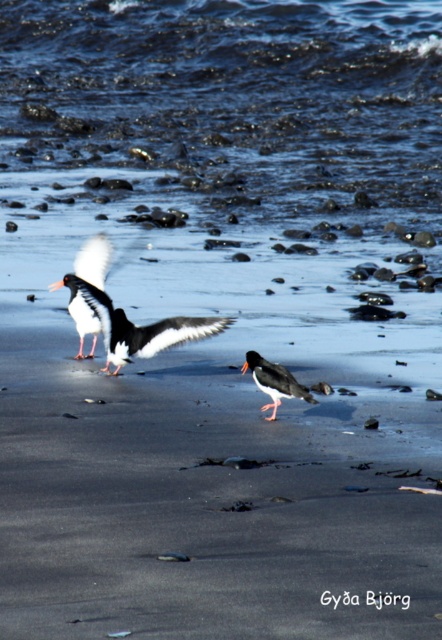
You are a birdwatcher observing the scene. You notice two birds at center. Which bird is closer to you, the white matte bird at center or the black glossy oystercatcher at center?

The white matte bird at center is closer to you because it is positioned over the black glossy oystercatcher at center, indicating it is in a forward spatial position.